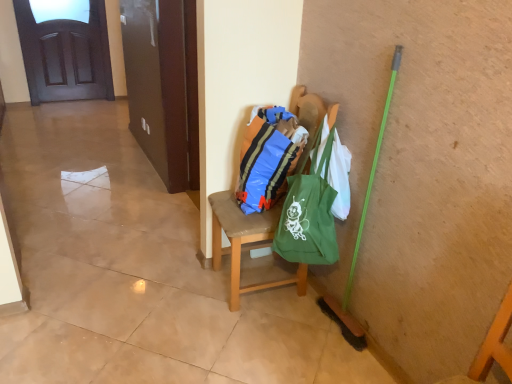
Identify the location of free point below green fabric bag at center (from a real-world perspective). (268, 276).